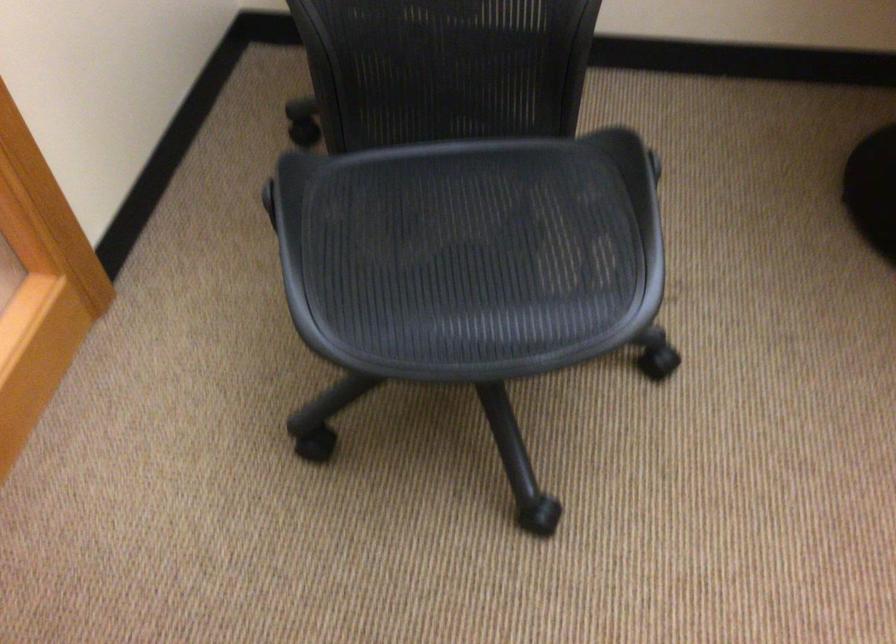
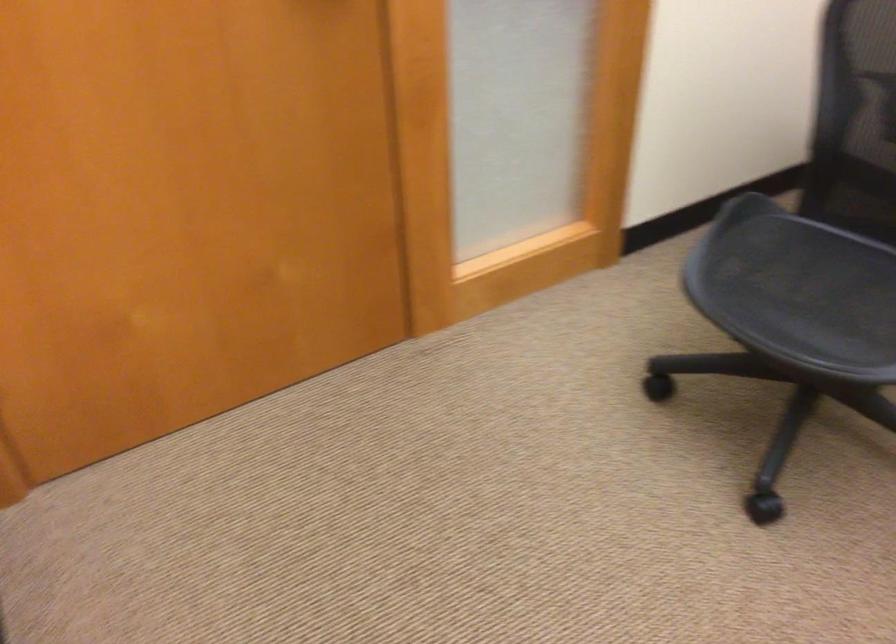
Question: The camera is either moving clockwise (left) or counter-clockwise (right) around the object. The first image is from the beginning of the video and the second image is from the end. Is the camera moving left or right when shooting the video?

Choices:
 (A) Left
 (B) Right

Answer: (B)